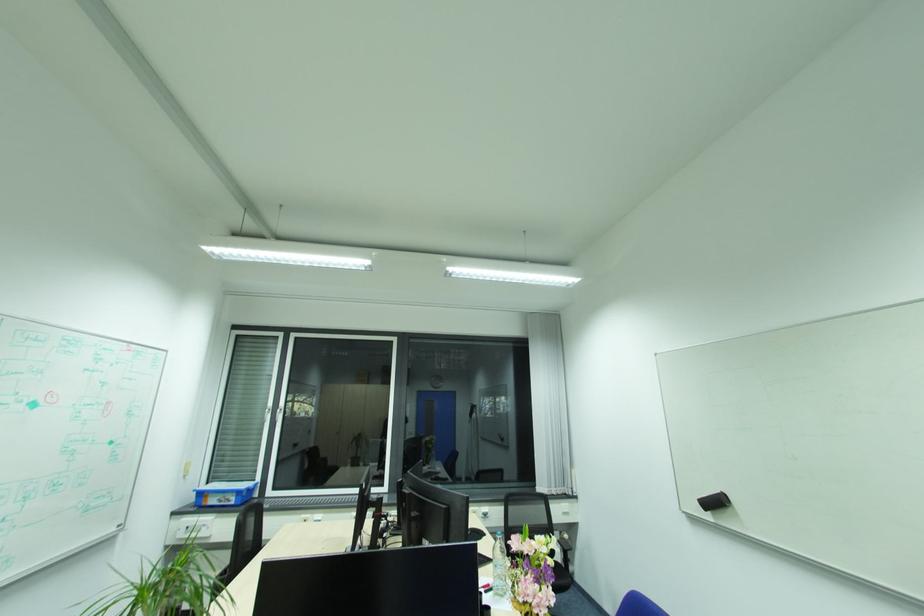
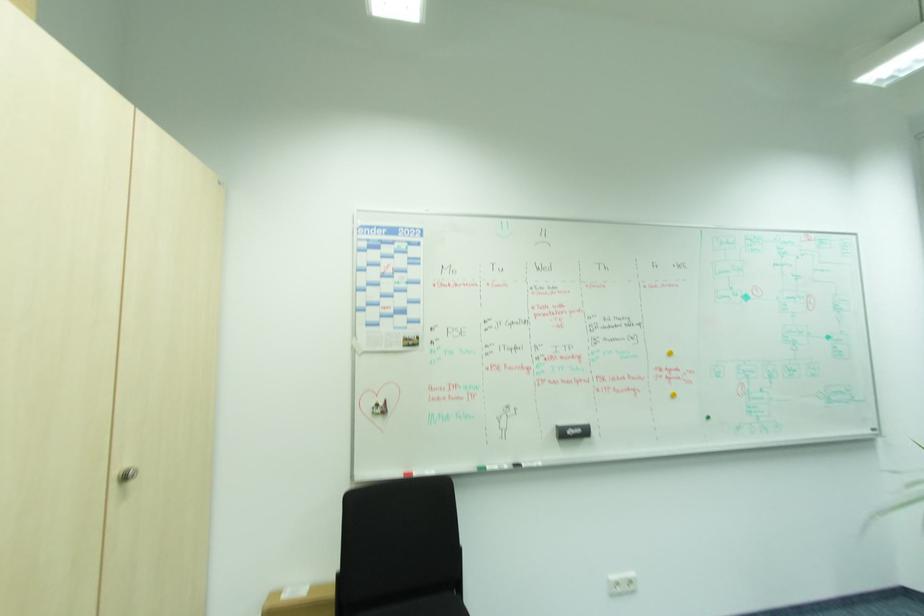
Question: The first image is from the beginning of the video and the second image is from the end. How did the camera likely rotate when shooting the video?

Choices:
 (A) Left
 (B) Right
 (C) Up
 (D) Down

Answer: (A)